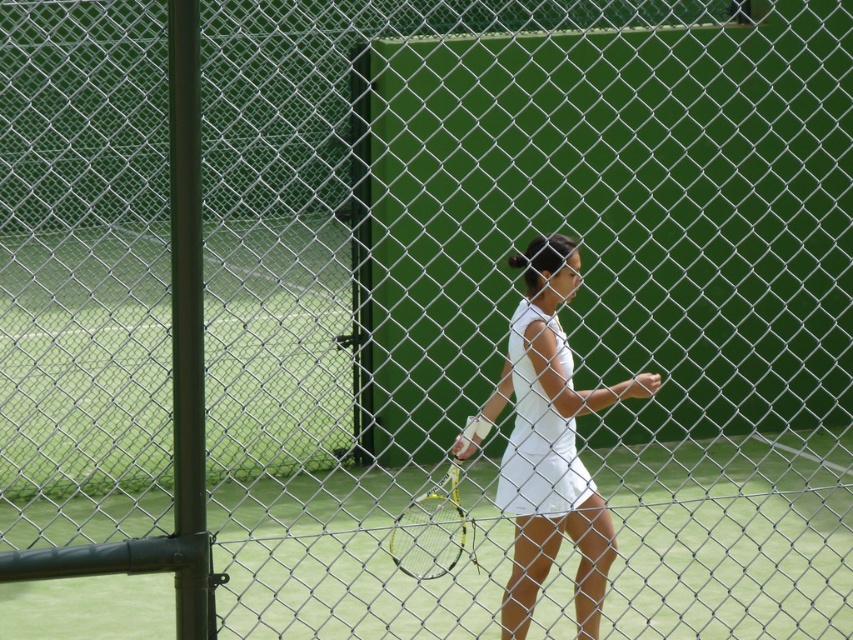
The image size is (853, 640). What do you see at coordinates (538, 433) in the screenshot?
I see `white matte dress at center` at bounding box center [538, 433].

Is white matte dress at center above green metallic racket at center?

Correct, white matte dress at center is located above green metallic racket at center.

Describe the element at coordinates (538, 433) in the screenshot. I see `white matte dress at center` at that location.

At what (x,y) coordinates should I click in order to perform the action: click on white matte dress at center. Please return your answer as a coordinate pair (x, y). This screenshot has width=853, height=640. Looking at the image, I should click on (538, 433).

Who is more distant from viewer, (x=566, y=444) or (x=523, y=486)?

The point (x=566, y=444) is more distant.

Looking at this image, can you confirm if white matte tennis dress at center is thinner than white matte dress at center?

In fact, white matte tennis dress at center might be wider than white matte dress at center.

This screenshot has width=853, height=640. Describe the element at coordinates (549, 444) in the screenshot. I see `white matte tennis dress at center` at that location.

This screenshot has width=853, height=640. In order to click on white matte tennis dress at center in this screenshot , I will do `click(549, 444)`.

The width and height of the screenshot is (853, 640). Identify the location of white matte tennis dress at center. (549, 444).

Is white matte tennis dress at center wider than green metallic racket at center?

Correct, the width of white matte tennis dress at center exceeds that of green metallic racket at center.

Between point (514, 499) and point (457, 508), which one is positioned in front?

Point (514, 499) is more forward.

The image size is (853, 640). In order to click on white matte tennis dress at center in this screenshot , I will do `click(549, 444)`.